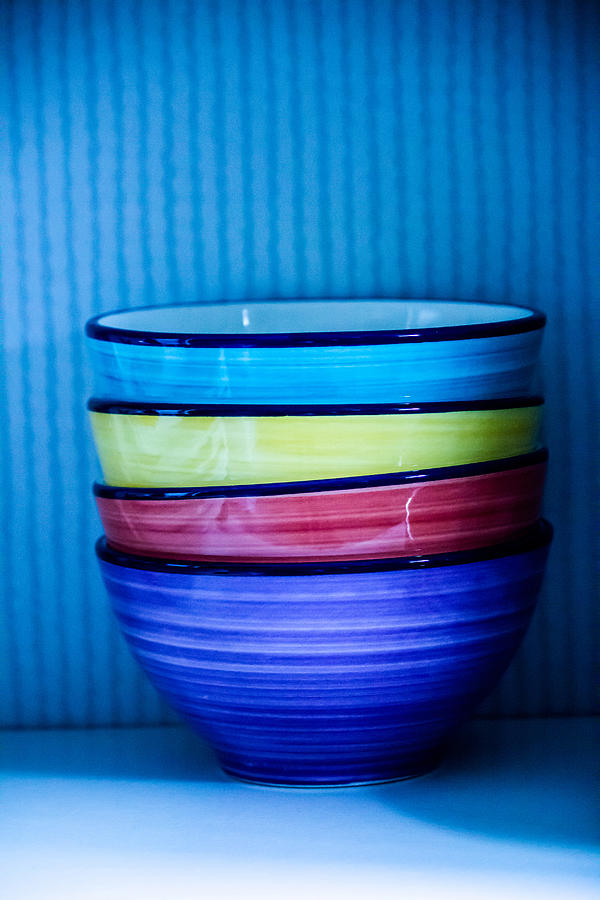
Identify the location of white flat surface. (292, 840).